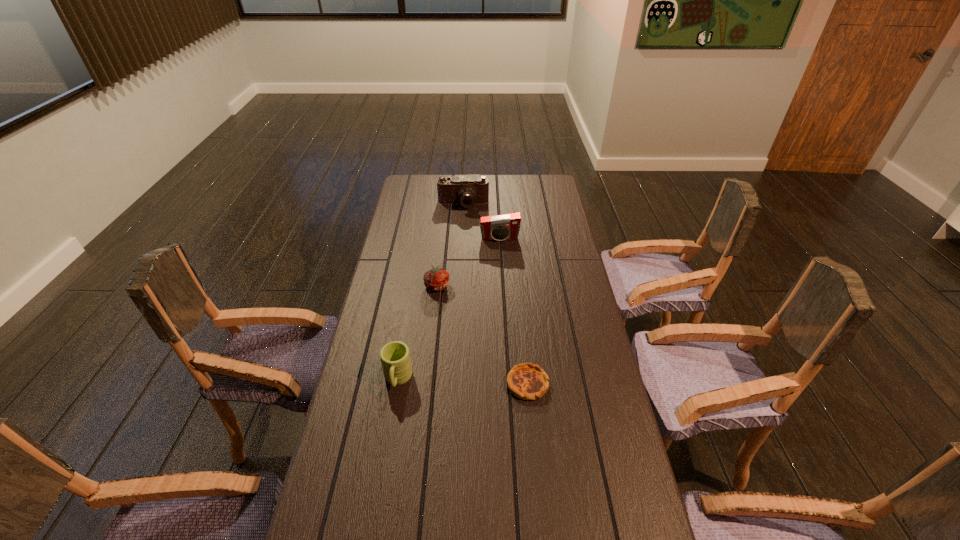
Image resolution: width=960 pixels, height=540 pixels. What are the coordinates of `the farther camera` in the screenshot? It's located at (468, 190).

I want to click on the nearer camera, so click(499, 227).

Where is `mug`? This screenshot has width=960, height=540. mug is located at coordinates (395, 358).

The height and width of the screenshot is (540, 960). What are the coordinates of `tomato` in the screenshot? It's located at (436, 279).

Locate an element on the screen. This screenshot has height=540, width=960. the second shortest object is located at coordinates (436, 279).

Where is `quiche`? The image size is (960, 540). quiche is located at coordinates (526, 381).

Locate an element on the screen. This screenshot has height=540, width=960. vacant point located 0.280m on the front-facing side of the farther camera is located at coordinates (461, 250).

You are a GUI agent. You are given a task and a screenshot of the screen. Output one action in this format:
    pyautogui.click(x=<x>, y=<y>)
    Task: Click on the blank space located 0.330m on the front-facing side of the nearer camera
    
    Given the screenshot: What is the action you would take?
    pyautogui.click(x=503, y=298)

Identify the location of vacant space situated 0.120m on the side of the mug with the handle. (388, 436).

Identify the location of free point located 0.170m on the front of the third nearest object. Image resolution: width=960 pixels, height=540 pixels. (432, 330).